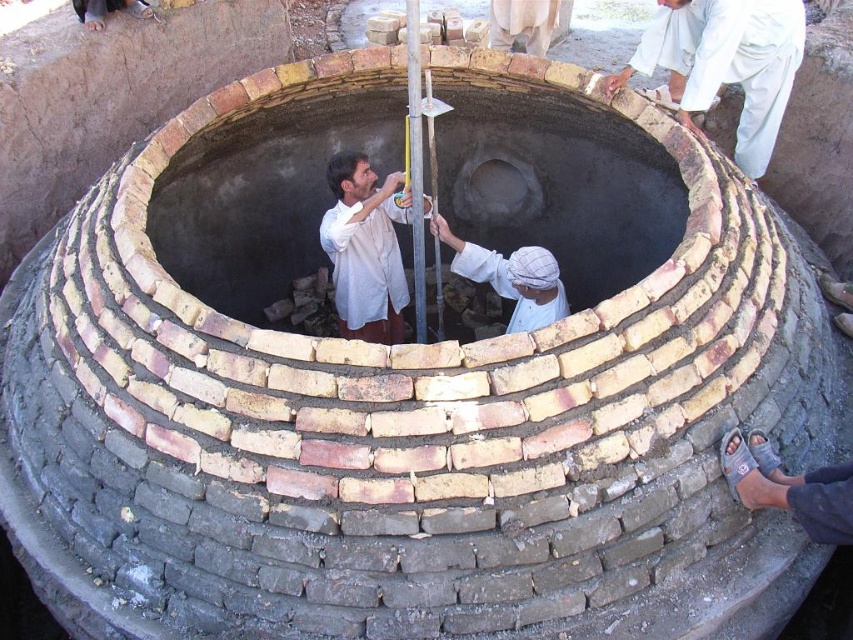
You are standing at the entrance of the circular brick structure and want to locate two specific points marked in the image. Which of the two points, point (396, 300) or point (763, 468), is closer to you?

Point (763, 468) is closer to you because it is in front of point (396, 300).

You are a construction worker who needs to place a protective cover over the white cloth at center. The brown leather sandal at lower right is in the way. Can you move the sandal to the side without the cloth moving?

The brown leather sandal at lower right has a lesser width compared to white cloth at center, so moving the sandal is possible without disturbing the cloth since the sandal takes up less space.

You are a construction worker standing at the entrance of the brick structure. You need to place a tool box that is 3 feet wide between the brick oven at center and the white cloth at center. Is there enough space between them to fit the tool box?

The brick oven at center is 5.78 feet away from the white cloth at center. Since the tool box is 3 feet wide, there is enough space between them to fit the tool box as the distance is greater than the tool box width.